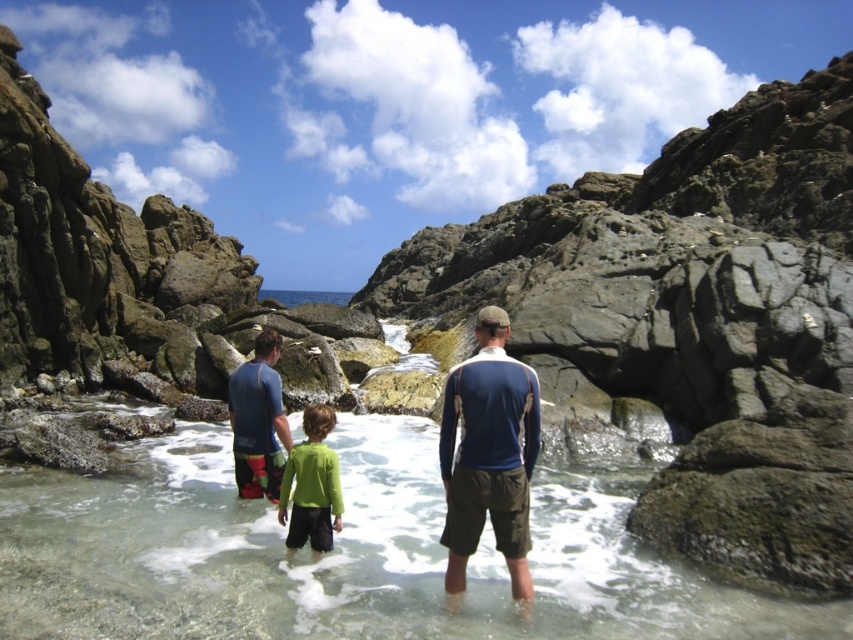
You are taking a photo of the coastal scene and want to focus on the two points marked in the image. Which point, point (480, 428) or point (332, 515), is closer to your camera lens?

Point (480, 428) is closer to the camera lens than point (332, 515).